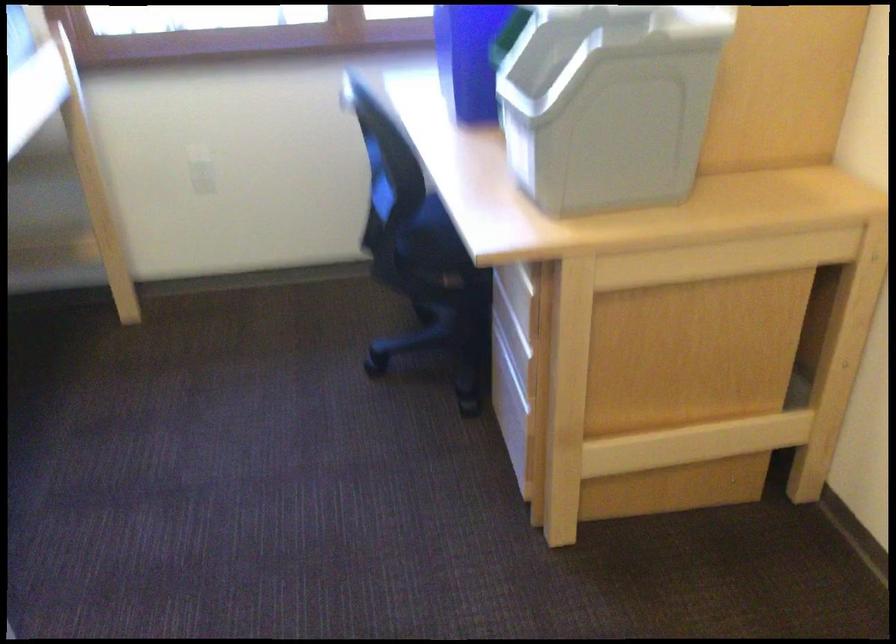
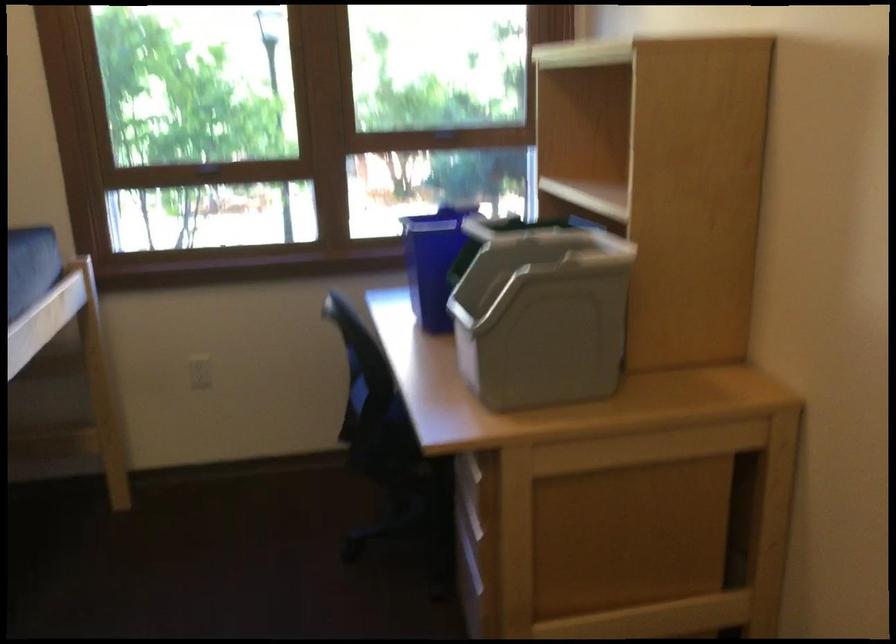
The point at (613,98) is marked in the first image. Where is the corresponding point in the second image?

(540, 313)